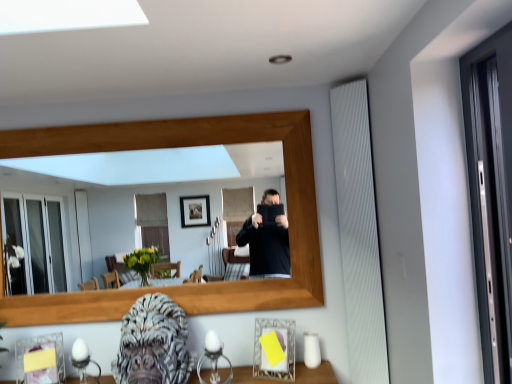
Question: Could you tell me if matte glass picture frame at lower right, which is counted as the 2th picture frame, starting from the left, is turned towards gray textured gorilla head at lower center?

Choices:
 (A) no
 (B) yes

Answer: (A)

Question: Considering the relative sizes of matte glass picture frame at lower right, which is counted as the 2th picture frame, starting from the left, and gray textured gorilla head at lower center in the image provided, is matte glass picture frame at lower right, which is counted as the 2th picture frame, starting from the left, smaller than gray textured gorilla head at lower center?

Choices:
 (A) no
 (B) yes

Answer: (B)

Question: Is the position of matte glass picture frame at lower right, which is counted as the 1th picture frame, starting from the right, less distant than that of gray textured gorilla head at lower center?

Choices:
 (A) yes
 (B) no

Answer: (B)

Question: Does matte glass picture frame at lower right, which is counted as the 1th picture frame, starting from the right, have a larger size compared to gray textured gorilla head at lower center?

Choices:
 (A) yes
 (B) no

Answer: (B)

Question: Could gray textured gorilla head at lower center be considered to be inside matte glass picture frame at lower right, which is counted as the 2th picture frame, starting from the left?

Choices:
 (A) yes
 (B) no

Answer: (B)

Question: Is wooden frame at center bigger or smaller than gray textured gorilla head at lower center?

Choices:
 (A) big
 (B) small

Answer: (A)

Question: Considering the positions of wooden frame at center and gray textured gorilla head at lower center in the image, is wooden frame at center taller or shorter than gray textured gorilla head at lower center?

Choices:
 (A) tall
 (B) short

Answer: (A)

Question: Considering the positions of point (97, 258) and point (161, 294), is point (97, 258) closer or farther from the camera than point (161, 294)?

Choices:
 (A) closer
 (B) farther

Answer: (B)

Question: From a real-world perspective, is wooden frame at center positioned above or below gray textured gorilla head at lower center?

Choices:
 (A) above
 (B) below

Answer: (A)

Question: Looking at their shapes, would you say matte glass picture frame at lower right, which is counted as the 1th picture frame, starting from the right, is wider or thinner than yellow paper at lower left, which is counted as the first picture frame, starting from the left?

Choices:
 (A) wide
 (B) thin

Answer: (A)

Question: From a real-world perspective, is matte glass picture frame at lower right, which is counted as the 2th picture frame, starting from the left, positioned above or below yellow paper at lower left, which is the 2th picture frame from right to left?

Choices:
 (A) below
 (B) above

Answer: (B)

Question: Considering their positions, is matte glass picture frame at lower right, which is counted as the 2th picture frame, starting from the left, located in front of or behind yellow paper at lower left, which is the 2th picture frame from right to left?

Choices:
 (A) front
 (B) behind

Answer: (A)

Question: Is matte glass picture frame at lower right, which is counted as the 1th picture frame, starting from the right, bigger or smaller than yellow paper at lower left, which is counted as the first picture frame, starting from the left?

Choices:
 (A) small
 (B) big

Answer: (B)

Question: Considering the positions of wooden frame at center and yellow paper at lower left, which is the 2th picture frame from right to left, in the image, is wooden frame at center bigger or smaller than yellow paper at lower left, which is the 2th picture frame from right to left,?

Choices:
 (A) big
 (B) small

Answer: (A)

Question: Considering the positions of point (216, 211) and point (15, 367), is point (216, 211) closer or farther from the camera than point (15, 367)?

Choices:
 (A) closer
 (B) farther

Answer: (B)